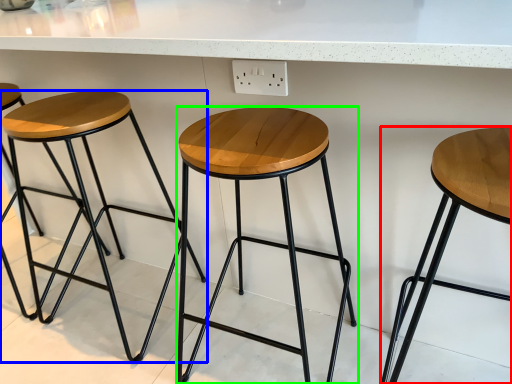
Question: Considering the real-world distances, which object is farthest from stool (highlighted by a red box)? stool (highlighted by a blue box) or stool (highlighted by a green box)?

Choices:
 (A) stool
 (B) stool

Answer: (A)